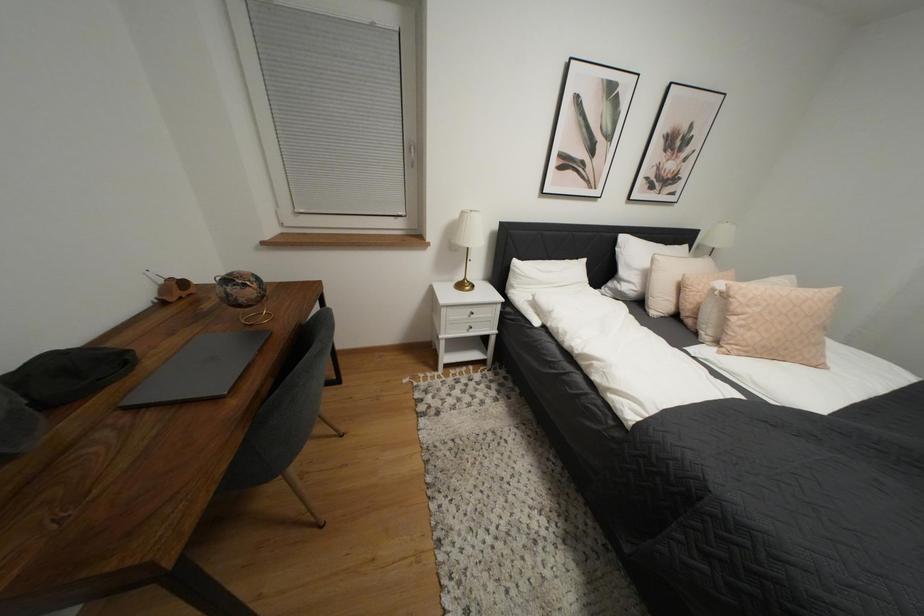
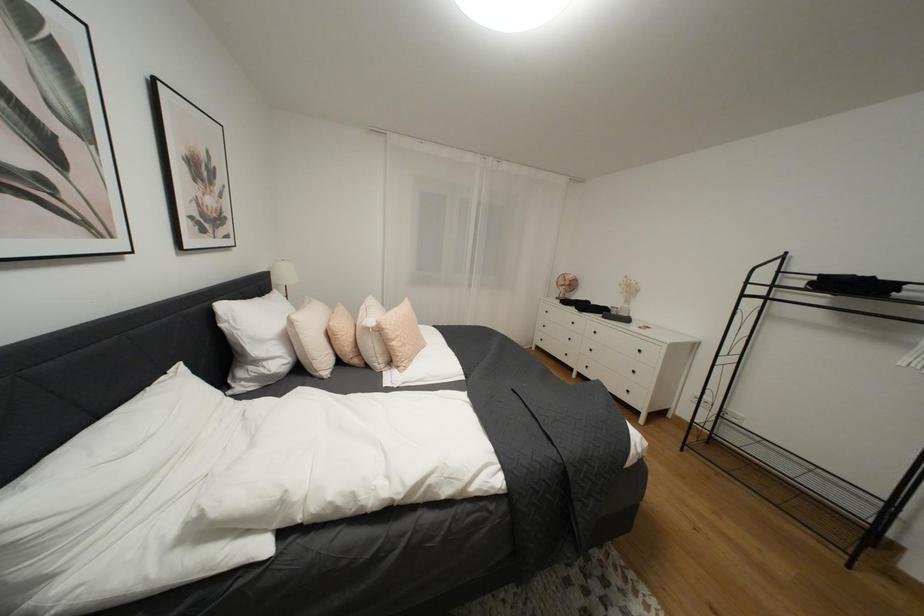
First-person continuous shooting, in which direction is the camera rotating?

The camera rotated toward right-down.